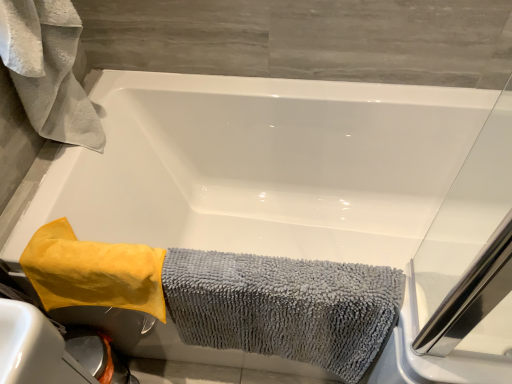
Question: Is yellow microfiber towel at lower left, the second bath towel viewed from the left, in front of white fluffy towel at upper left, which appears as the 1th bath towel when viewed from the left?

Choices:
 (A) yes
 (B) no

Answer: (B)

Question: Is yellow microfiber towel at lower left, the second bath towel viewed from the left, next to white fluffy towel at upper left, which is the 3th bath towel in right-to-left order, and touching it?

Choices:
 (A) no
 (B) yes

Answer: (A)

Question: Considering the relative positions of yellow microfiber towel at lower left, the second bath towel viewed from the left, and white fluffy towel at upper left, which appears as the 1th bath towel when viewed from the left, in the image provided, is yellow microfiber towel at lower left, the second bath towel viewed from the left, to the left of white fluffy towel at upper left, which appears as the 1th bath towel when viewed from the left, from the viewer's perspective?

Choices:
 (A) no
 (B) yes

Answer: (A)

Question: From a real-world perspective, is yellow microfiber towel at lower left, the second bath towel viewed from the left, physically above white fluffy towel at upper left, which is the 3th bath towel in right-to-left order?

Choices:
 (A) no
 (B) yes

Answer: (A)

Question: Can you confirm if yellow microfiber towel at lower left, which ranks as the second bath towel in right-to-left order, is bigger than white fluffy towel at upper left, which is the 3th bath towel in right-to-left order?

Choices:
 (A) yes
 (B) no

Answer: (B)

Question: Is yellow microfiber towel at lower left, which ranks as the second bath towel in right-to-left order, turned away from white fluffy towel at upper left, which is the 3th bath towel in right-to-left order?

Choices:
 (A) yes
 (B) no

Answer: (B)

Question: Can you confirm if yellow microfiber towel at lower left, which ranks as the second bath towel in right-to-left order, is shorter than gray microfiber towel at lower left, which is the third bath towel from left to right?

Choices:
 (A) yes
 (B) no

Answer: (A)

Question: Is yellow microfiber towel at lower left, which ranks as the second bath towel in right-to-left order, far from gray microfiber towel at lower left, positioned as the 1th bath towel in right-to-left order?

Choices:
 (A) yes
 (B) no

Answer: (B)

Question: Does yellow microfiber towel at lower left, the second bath towel viewed from the left, have a lesser width compared to gray microfiber towel at lower left, which is the third bath towel from left to right?

Choices:
 (A) no
 (B) yes

Answer: (A)

Question: Considering the relative positions of yellow microfiber towel at lower left, the second bath towel viewed from the left, and gray microfiber towel at lower left, which is the third bath towel from left to right, in the image provided, is yellow microfiber towel at lower left, the second bath towel viewed from the left, to the left of gray microfiber towel at lower left, which is the third bath towel from left to right, from the viewer's perspective?

Choices:
 (A) no
 (B) yes

Answer: (B)

Question: Considering the relative sizes of yellow microfiber towel at lower left, the second bath towel viewed from the left, and gray microfiber towel at lower left, which is the third bath towel from left to right, in the image provided, is yellow microfiber towel at lower left, the second bath towel viewed from the left, bigger than gray microfiber towel at lower left, which is the third bath towel from left to right,?

Choices:
 (A) no
 (B) yes

Answer: (A)

Question: Is yellow microfiber towel at lower left, the second bath towel viewed from the left, at the right side of gray microfiber towel at lower left, positioned as the 1th bath towel in right-to-left order?

Choices:
 (A) yes
 (B) no

Answer: (B)

Question: Considering the relative positions of white fluffy towel at upper left, which appears as the 1th bath towel when viewed from the left, and gray microfiber towel at lower left, positioned as the 1th bath towel in right-to-left order, in the image provided, is white fluffy towel at upper left, which appears as the 1th bath towel when viewed from the left, to the right of gray microfiber towel at lower left, positioned as the 1th bath towel in right-to-left order, from the viewer's perspective?

Choices:
 (A) no
 (B) yes

Answer: (A)